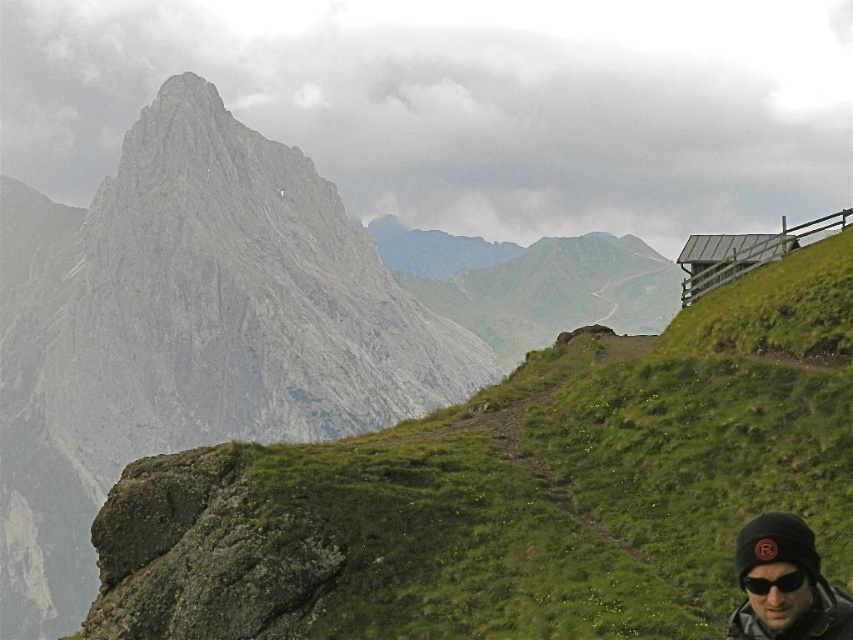
Question: Can you confirm if gray rock mountain at upper left is bigger than black matte sunglasses at lower right?

Choices:
 (A) no
 (B) yes

Answer: (B)

Question: Which of the following is the farthest from the observer?

Choices:
 (A) black matte sunglasses at lower right
 (B) gray rock mountain at upper left

Answer: (B)

Question: Is green grassy at upper center positioned before black matte sunglasses at lower right?

Choices:
 (A) yes
 (B) no

Answer: (B)

Question: Does gray rock mountain at upper left have a lesser width compared to black matte sunglasses at lower right?

Choices:
 (A) no
 (B) yes

Answer: (A)

Question: Which object appears farthest from the camera in this image?

Choices:
 (A) black matte sunglasses at lower right
 (B) black knit cap at lower right

Answer: (A)

Question: Which of the following is the farthest from the observer?

Choices:
 (A) (1, 612)
 (B) (357, 570)
 (C) (764, 579)

Answer: (A)